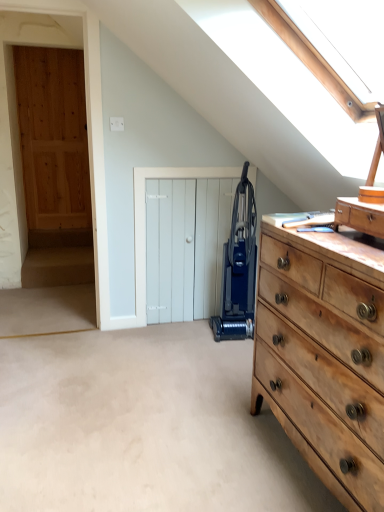
Question: Would you say blue plastic vacuum cleaner at center is to the left or to the right of natural wood dresser at right in the picture?

Choices:
 (A) left
 (B) right

Answer: (A)

Question: Is blue plastic vacuum cleaner at center situated inside natural wood dresser at right or outside?

Choices:
 (A) inside
 (B) outside

Answer: (B)

Question: Which object is positioned closest to the natural wood dresser at right?

Choices:
 (A) white wooden door at center
 (B) wooden drawer at right
 (C) blue plastic vacuum cleaner at center

Answer: (B)

Question: Estimate the real-world distances between objects in this image. Which object is closer to the white wooden door at center?

Choices:
 (A) blue plastic vacuum cleaner at center
 (B) wooden drawer at right
 (C) natural wood dresser at right

Answer: (A)